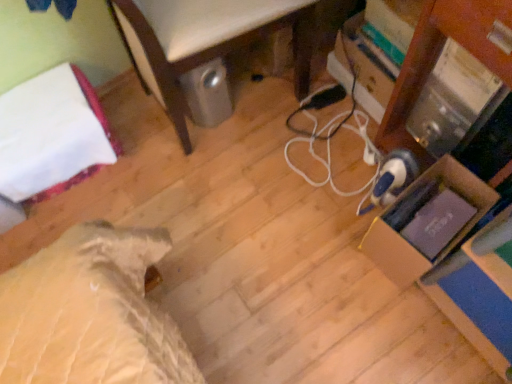
At what (x,y) coordinates should I click in order to perform the action: click on free point to the left of white cord at center. Please return your answer as a coordinate pair (x, y). The height and width of the screenshot is (384, 512). Looking at the image, I should click on (254, 180).